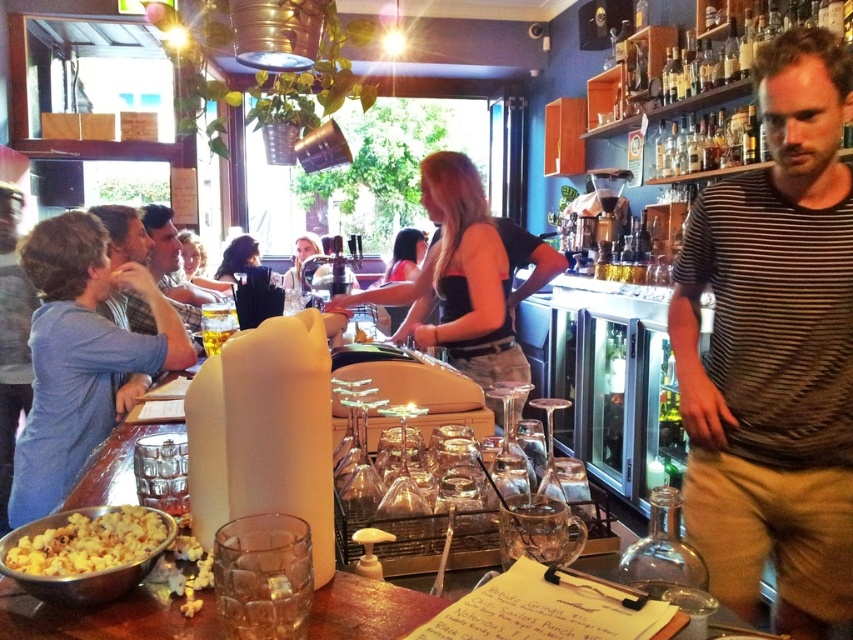
You are a bartender trying to place a new drink order on the counter. There is a brown striped shirt at center and a plaid shirt at left nearby. Which shirt should you avoid placing the order near to ensure there is enough space?

The brown striped shirt at center might be wider than plaid shirt at left, so you should avoid placing the order near the brown striped shirt at center to ensure enough space.

You are standing at the entrance of the bar and want to reach both points marked in the image. Which point, point (x=846, y=253) or point (x=166, y=289), will you encounter first as you move forward?

You will encounter point (x=846, y=253) first because it is closer to you than point (x=166, y=289).

You are a bartender at this bar. You need to reach the gray cotton shirt at left to hand them a drink. Is the golden popcorn at lower left in your way?

The golden popcorn at lower left is located below the gray cotton shirt at left, so it is not blocking the path to the gray cotton shirt at left.